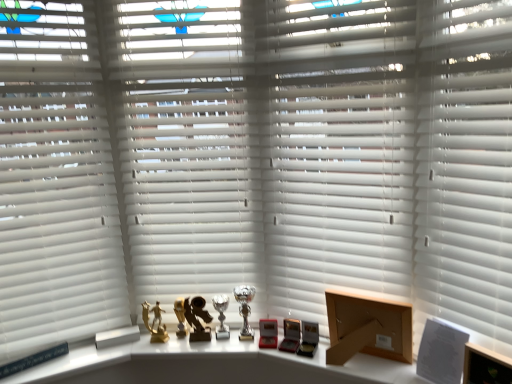
Identify the location of gold metallic figurine at center, the 1th toy in the right-to-left sequence. Image resolution: width=512 pixels, height=384 pixels. (196, 318).

Image resolution: width=512 pixels, height=384 pixels. What do you see at coordinates (186, 146) in the screenshot?
I see `white matte shutter at center, placed as the 1th shutter when sorted from left to right` at bounding box center [186, 146].

In order to face white matte shutter at center, the third shutter viewed from the left, should I rotate leftwards or rightwards?

You should look right and rotate roughly 26.319 degrees.

Locate an element on the screen. This screenshot has width=512, height=384. silver metallic trophy at center, acting as the first table lamp starting from the right is located at coordinates (245, 309).

Is gold metallic figurine at center, which is counted as the second toy, starting from the right, smaller than silver metallic trophy at center, acting as the first table lamp starting from the right?

Yes, gold metallic figurine at center, which is counted as the second toy, starting from the right, is smaller than silver metallic trophy at center, acting as the first table lamp starting from the right.

Is gold metallic figurine at center, placed as the 1th toy when sorted from left to right, not near silver metallic trophy at center, the second table lamp viewed from the left?

That's not correct — gold metallic figurine at center, placed as the 1th toy when sorted from left to right, is a little close to silver metallic trophy at center, the second table lamp viewed from the left.

In the scene shown: Which is more to the left, gold metallic figurine at center, which is counted as the second toy, starting from the right, or silver metallic trophy at center, acting as the first table lamp starting from the right?

From the viewer's perspective, gold metallic figurine at center, which is counted as the second toy, starting from the right, appears more on the left side.

Is metallic trophies at center looking in the opposite direction of wooden box at lower right?

That's not correct — metallic trophies at center is not looking away from wooden box at lower right.

Measure the distance between metallic trophies at center and wooden box at lower right.

The distance of metallic trophies at center from wooden box at lower right is 10.51 inches.

Does metallic trophies at center lie in front of wooden box at lower right?

Yes, metallic trophies at center is closer to the camera.

From the image's perspective, which is below, metallic trophies at center or wooden box at lower right?

From the image's view, metallic trophies at center is below.

Is point (395, 196) farther from camera compared to point (218, 306)?

No, (395, 196) is in front of (218, 306).

Which of these two, white matte blinds at center, positioned as the 2th shutter in right-to-left order, or silver metallic trophy at center, which ranks as the first table lamp in left-to-right order, stands taller?

Standing taller between the two is white matte blinds at center, positioned as the 2th shutter in right-to-left order.

Is white matte blinds at center, positioned as the 2th shutter in right-to-left order, inside the boundaries of silver metallic trophy at center, which ranks as the first table lamp in left-to-right order, or outside?

white matte blinds at center, positioned as the 2th shutter in right-to-left order, is not enclosed by silver metallic trophy at center, which ranks as the first table lamp in left-to-right order.

Is silver metallic trophy at center, which ranks as the first table lamp in left-to-right order, at the back of white matte blinds at center, positioned as the 2th shutter in right-to-left order?

white matte blinds at center, positioned as the 2th shutter in right-to-left order, is not turned away from silver metallic trophy at center, which ranks as the first table lamp in left-to-right order.

From the image's perspective, is gold metallic figurine at center, the 1th toy in the right-to-left sequence, on top of white matte blinds at left?

No, from the image's perspective, gold metallic figurine at center, the 1th toy in the right-to-left sequence, is not over white matte blinds at left.

Which of these two, gold metallic figurine at center, which appears as the second toy when viewed from the left, or white matte blinds at left, is smaller?

gold metallic figurine at center, which appears as the second toy when viewed from the left.

Is point (192, 338) positioned before point (9, 111)?

That is False.

Does gold metallic figurine at center, the 1th toy in the right-to-left sequence, have a lesser width compared to white matte blinds at left?

Indeed, gold metallic figurine at center, the 1th toy in the right-to-left sequence, has a lesser width compared to white matte blinds at left.

From a real-world perspective, is gold metallic figurine at center, placed as the 1th toy when sorted from left to right, under silver metallic trophy at center, which ranks as the first table lamp in left-to-right order?

No, from a real-world perspective, gold metallic figurine at center, placed as the 1th toy when sorted from left to right, is not below silver metallic trophy at center, which ranks as the first table lamp in left-to-right order.

What's the angular difference between gold metallic figurine at center, placed as the 1th toy when sorted from left to right, and silver metallic trophy at center, which ranks as the first table lamp in left-to-right order,'s facing directions?

The facing directions of gold metallic figurine at center, placed as the 1th toy when sorted from left to right, and silver metallic trophy at center, which ranks as the first table lamp in left-to-right order, are 2.64 degrees apart.

From the picture: From the image's perspective, which one is positioned lower, gold metallic figurine at center, placed as the 1th toy when sorted from left to right, or silver metallic trophy at center, the second table lamp from the right?

gold metallic figurine at center, placed as the 1th toy when sorted from left to right, is shown below in the image.

From the picture: In terms of size, does gold metallic figurine at center, placed as the 1th toy when sorted from left to right, appear bigger or smaller than silver metallic trophy at center, the second table lamp from the right?

Clearly, gold metallic figurine at center, placed as the 1th toy when sorted from left to right, is smaller in size than silver metallic trophy at center, the second table lamp from the right.

Which object is wider, white matte shutter at center, the third shutter viewed from the left, or white matte blinds at left?

white matte blinds at left is wider.

From the image's perspective, does white matte shutter at center, positioned as the 1th shutter in right-to-left order, appear higher than white matte blinds at left?

Incorrect, from the image's perspective, white matte shutter at center, positioned as the 1th shutter in right-to-left order, is lower than white matte blinds at left.

Considering the relative positions of white matte shutter at center, positioned as the 1th shutter in right-to-left order, and white matte blinds at left in the image provided, is white matte shutter at center, positioned as the 1th shutter in right-to-left order, in front of white matte blinds at left?

Yes.

Would you say gold metallic trophy at center is inside or outside white matte shutter at center, the third shutter viewed from the right?

gold metallic trophy at center fits inside white matte shutter at center, the third shutter viewed from the right.

Is gold metallic trophy at center to the left of white matte shutter at center, the third shutter viewed from the right, from the viewer's perspective?

Correct, you'll find gold metallic trophy at center to the left of white matte shutter at center, the third shutter viewed from the right.

Could you tell me if gold metallic trophy at center is facing white matte shutter at center, the third shutter viewed from the right?

Yes, gold metallic trophy at center is oriented towards white matte shutter at center, the third shutter viewed from the right.

Can you confirm if gold metallic trophy at center is bigger than white matte shutter at center, the third shutter viewed from the right?

No.

This screenshot has width=512, height=384. I want to click on table lamp that is the 2nd object located above the gold metallic figurine at center, placed as the 1th toy when sorted from left to right (from the image's perspective), so click(245, 309).

Image resolution: width=512 pixels, height=384 pixels. In the image, there is a wooden box at lower right. Find the location of `table below it (from the image's perspective)`. table below it (from the image's perspective) is located at coordinates (209, 365).

Which object lies further to the anchor point wooden box at lower right, metallic trophies at center or gold metallic figurine at center, placed as the 1th toy when sorted from left to right?

The object further to wooden box at lower right is gold metallic figurine at center, placed as the 1th toy when sorted from left to right.

Looking at the image, which one is located closer to gold metallic figurine at center, placed as the 1th toy when sorted from left to right, white matte shutter at center, positioned as the 1th shutter in right-to-left order, or white matte shutter at center, placed as the 1th shutter when sorted from left to right?

Based on the image, white matte shutter at center, placed as the 1th shutter when sorted from left to right, appears to be nearer to gold metallic figurine at center, placed as the 1th toy when sorted from left to right.

When comparing their distances from white matte blinds at left, does white matte blinds at center, the 2th shutter positioned from the left, or metallic trophies at center seem further?

The object further to white matte blinds at left is white matte blinds at center, the 2th shutter positioned from the left.

Estimate the real-world distances between objects in this image. Which object is further from metallic trophies at center, gold metallic trophy at center or white matte shutter at center, the third shutter viewed from the left?

white matte shutter at center, the third shutter viewed from the left, is positioned further to the anchor metallic trophies at center.

Looking at the image, which one is located further to silver metallic trophy at center, the second table lamp from the right, white matte blinds at center, positioned as the 2th shutter in right-to-left order, or silver metallic trophy at center, acting as the first table lamp starting from the right?

The object further to silver metallic trophy at center, the second table lamp from the right, is white matte blinds at center, positioned as the 2th shutter in right-to-left order.

From the image, which object appears to be nearer to gold metallic figurine at center, which is counted as the second toy, starting from the right, metallic trophies at center or wooden box at lower right?

The object closer to gold metallic figurine at center, which is counted as the second toy, starting from the right, is metallic trophies at center.

Considering their positions, is silver metallic trophy at center, acting as the first table lamp starting from the right, positioned further to gold metallic figurine at center, which appears as the second toy when viewed from the left, than metallic trophies at center?

Among the two, metallic trophies at center is located further to gold metallic figurine at center, which appears as the second toy when viewed from the left.

From the image, which object appears to be farther from white matte shutter at center, the third shutter viewed from the right, white matte shutter at center, the third shutter viewed from the left, or metallic trophies at center?

white matte shutter at center, the third shutter viewed from the left.

Identify the location of table lamp between metallic trophies at center and silver metallic trophy at center, which ranks as the first table lamp in left-to-right order, in the front-back direction. (245, 309).

The height and width of the screenshot is (384, 512). Find the location of `table situated between white matte blinds at left and white matte shutter at center, positioned as the 1th shutter in right-to-left order, from left to right`. table situated between white matte blinds at left and white matte shutter at center, positioned as the 1th shutter in right-to-left order, from left to right is located at coordinates (209, 365).

What are the coordinates of `table lamp between white matte blinds at center, the 2th shutter positioned from the left, and gold metallic figurine at center, the 1th toy in the right-to-left sequence, vertically` in the screenshot? It's located at (245, 309).

Where is `shutter situated between white matte shutter at center, placed as the 1th shutter when sorted from left to right, and white matte shutter at center, the third shutter viewed from the left, from left to right`? Image resolution: width=512 pixels, height=384 pixels. shutter situated between white matte shutter at center, placed as the 1th shutter when sorted from left to right, and white matte shutter at center, the third shutter viewed from the left, from left to right is located at coordinates (340, 150).